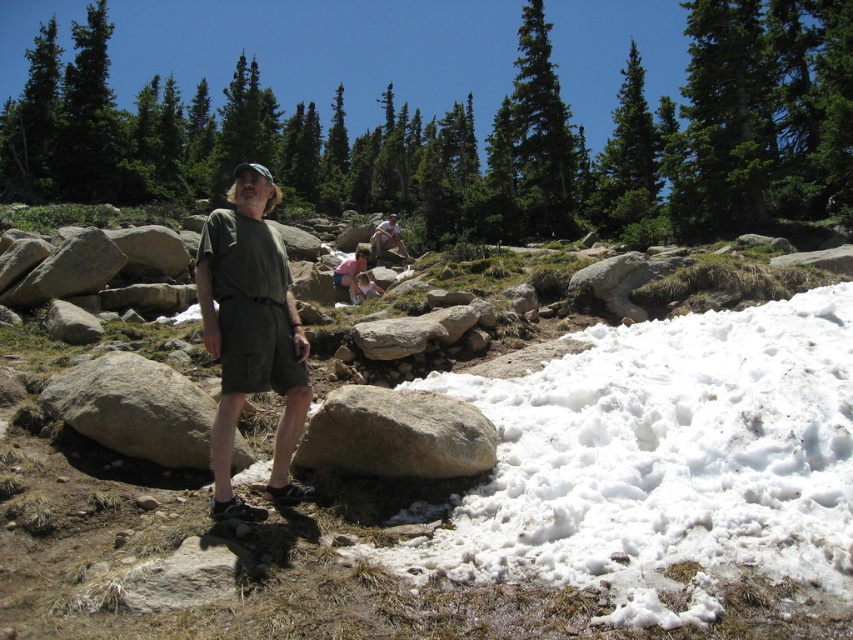
From the picture: You are a hiker trying to navigate the rocky terrain. You see the gray rough boulder at center and the gray rock at center. Which one is positioned lower in the scene?

The gray rough boulder at center is positioned below the gray rock at center, so it is lower in the scene.

You are a hiker who wants to take a photo of the matte green shirt at upper center without the white fluffy snow at lower right appearing in the frame. How should you adjust your camera angle?

Since the white fluffy snow at lower right is closer to the viewer than the matte green shirt at upper center, you can tilt your camera upward to frame the matte green shirt at upper center while avoiding the snow in the foreground.

You are a hiker who wants to know if the white fluffy snow at lower right is higher than the matte green shirt at upper center. Based on the scene, can you determine this?

The white fluffy snow at lower right is not as tall as matte green shirt at upper center, so the snow is lower than the shirt.